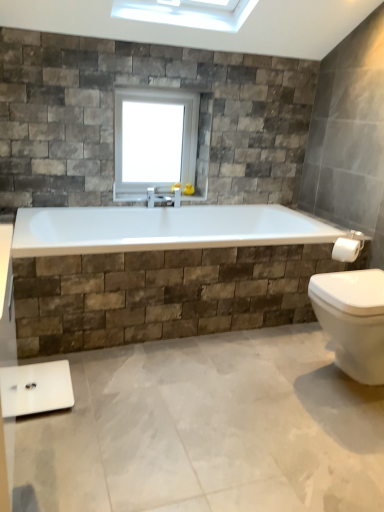
Question: Can you confirm if white glossy scale at lower left is wider than white glass window at upper center?

Choices:
 (A) yes
 (B) no

Answer: (A)

Question: Considering the relative sizes of white glossy scale at lower left and white glass window at upper center in the image provided, is white glossy scale at lower left thinner than white glass window at upper center?

Choices:
 (A) yes
 (B) no

Answer: (B)

Question: Considering the relative sizes of white glossy scale at lower left and white glass window at upper center in the image provided, is white glossy scale at lower left smaller than white glass window at upper center?

Choices:
 (A) no
 (B) yes

Answer: (B)

Question: Is white glossy scale at lower left with white glass window at upper center?

Choices:
 (A) no
 (B) yes

Answer: (A)

Question: Is there a large distance between white glossy scale at lower left and white glass window at upper center?

Choices:
 (A) yes
 (B) no

Answer: (A)

Question: Does white glossy scale at lower left lie in front of white glass window at upper center?

Choices:
 (A) yes
 (B) no

Answer: (A)

Question: Does white glass window at upper center turn towards white glossy towel bar at right?

Choices:
 (A) no
 (B) yes

Answer: (A)

Question: Considering the relative sizes of white glass window at upper center and white glossy towel bar at right in the image provided, is white glass window at upper center smaller than white glossy towel bar at right?

Choices:
 (A) yes
 (B) no

Answer: (B)

Question: Is white glass window at upper center beside white glossy towel bar at right?

Choices:
 (A) no
 (B) yes

Answer: (A)

Question: Are white glass window at upper center and white glossy towel bar at right far apart?

Choices:
 (A) no
 (B) yes

Answer: (B)

Question: Is white glass window at upper center at the right side of white glossy towel bar at right?

Choices:
 (A) yes
 (B) no

Answer: (B)

Question: From a real-world perspective, is white glass window at upper center under white glossy towel bar at right?

Choices:
 (A) no
 (B) yes

Answer: (A)

Question: Does white glass window at upper center have a lesser width compared to white glossy scale at lower left?

Choices:
 (A) no
 (B) yes

Answer: (B)